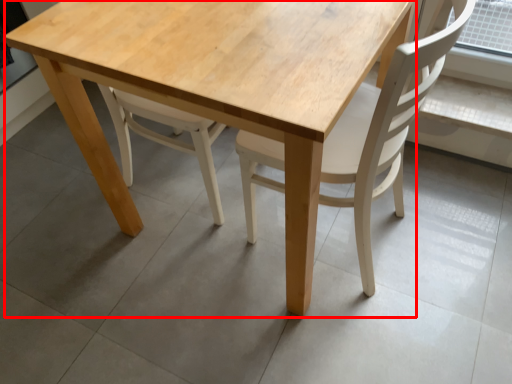
Question: Where is round table (annotated by the red box) located in relation to chair in the image?

Choices:
 (A) left
 (B) right

Answer: (A)